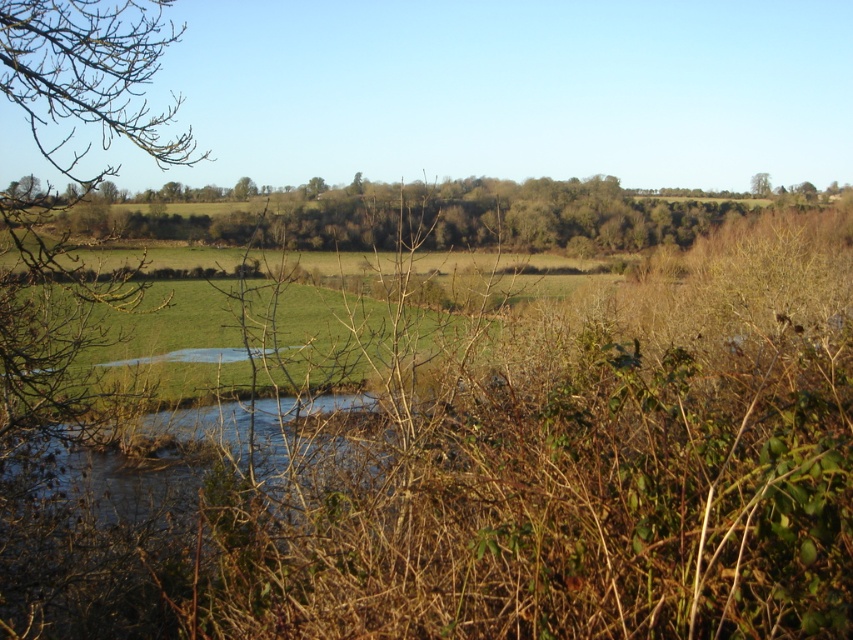
Question: Can you confirm if bare branches at upper left is wider than brown textured tree at center?

Choices:
 (A) no
 (B) yes

Answer: (B)

Question: Does bare branches at left appear under brown textured tree at center?

Choices:
 (A) no
 (B) yes

Answer: (A)

Question: Among these points, which one is nearest to the camera?

Choices:
 (A) (32, 22)
 (B) (248, 180)
 (C) (74, 90)

Answer: (A)

Question: Does bare branches at left appear under brown textured tree at center?

Choices:
 (A) no
 (B) yes

Answer: (A)

Question: Which of the following is the closest to the observer?

Choices:
 (A) (48, 38)
 (B) (312, 188)
 (C) (247, 177)

Answer: (A)

Question: Which of the following is the closest to the observer?

Choices:
 (A) bare branches at upper left
 (B) brown leafy tree at upper right

Answer: (A)